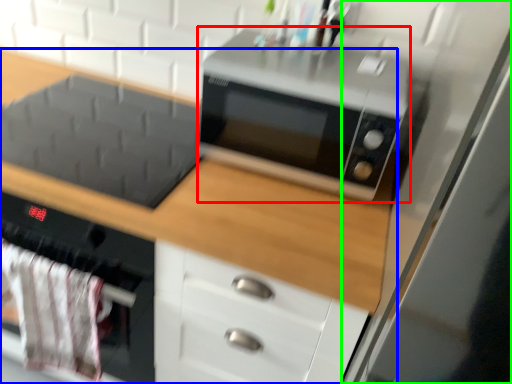
Question: Which is farther away from microwave oven (highlighted by a red box)? cabinetry (highlighted by a blue box) or glass door (highlighted by a green box)?

Choices:
 (A) cabinetry
 (B) glass door

Answer: (B)